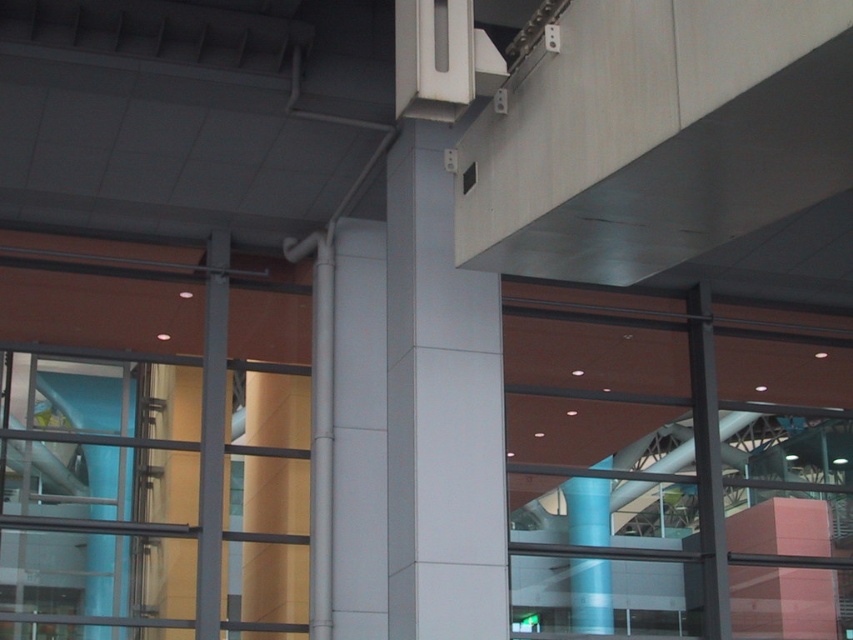
Does white glossy pillar at center have a lesser height compared to blue glossy column at center?

Yes, white glossy pillar at center is shorter than blue glossy column at center.

Measure the distance between white glossy pillar at center and camera.

white glossy pillar at center and camera are 12.29 meters apart.

Does point (410, 561) come in front of point (585, 604)?

Yes, point (410, 561) is in front of point (585, 604).

Locate an element on the screen. The image size is (853, 640). white glossy pillar at center is located at coordinates (439, 358).